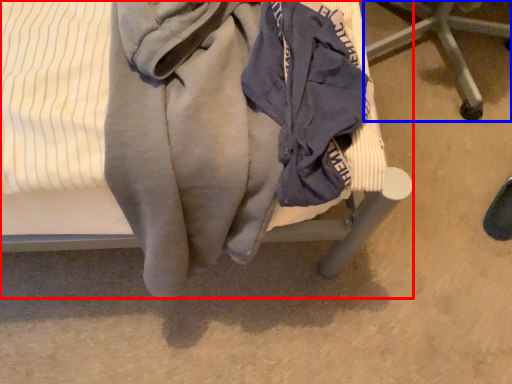
Question: Which object appears closest to the camera in this image, furniture (highlighted by a red box) or furniture (highlighted by a blue box)?

Choices:
 (A) furniture
 (B) furniture

Answer: (A)